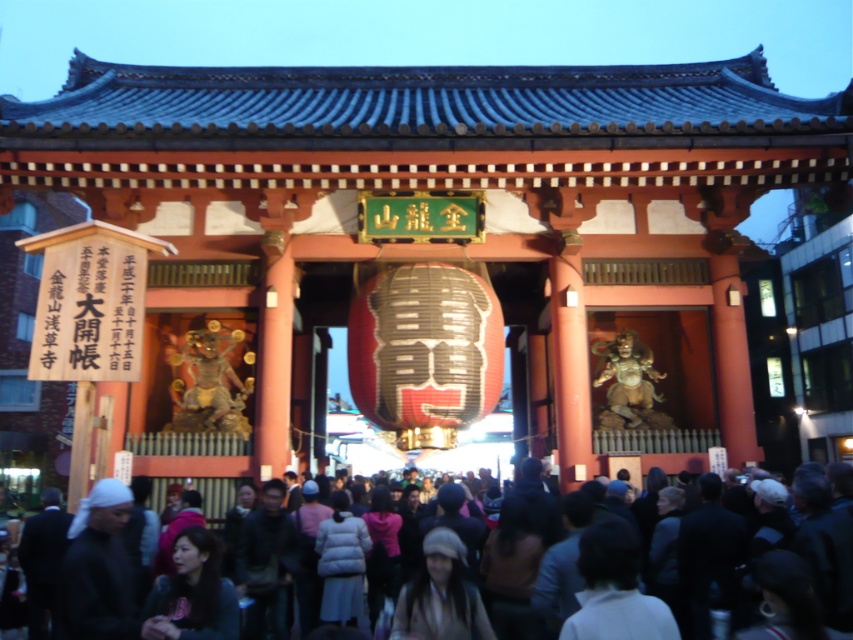
Question: Among these points, which one is nearest to the camera?

Choices:
 (A) (224, 586)
 (B) (740, 538)
 (C) (418, 608)

Answer: (C)

Question: Which object is the closest to the dark clothing crowd at lower center?

Choices:
 (A) light brown hair at center
 (B) matte black hair at lower center

Answer: (A)

Question: Can you confirm if matte black hair at lower center is thinner than light brown hair at center?

Choices:
 (A) yes
 (B) no

Answer: (A)

Question: Does dark clothing crowd at lower center lie in front of matte black hair at lower center?

Choices:
 (A) yes
 (B) no

Answer: (A)

Question: Can you confirm if matte black hair at lower center is thinner than light brown hair at center?

Choices:
 (A) no
 (B) yes

Answer: (B)

Question: Which is nearer to the matte black hair at lower center?

Choices:
 (A) dark clothing crowd at lower center
 (B) light brown hair at center

Answer: (B)